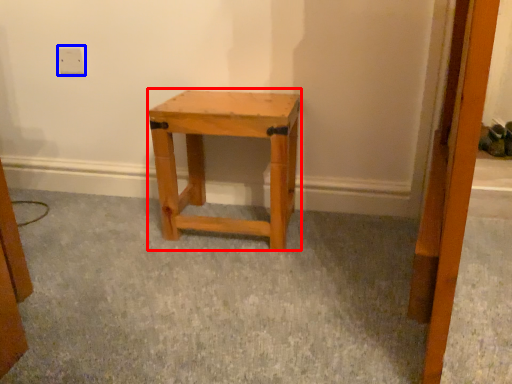
Question: Which of the following is the farthest to the observer, stool (highlighted by a red box) or electric outlet (highlighted by a blue box)?

Choices:
 (A) stool
 (B) electric outlet

Answer: (B)